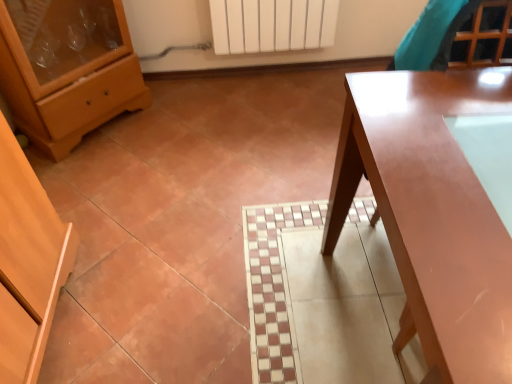
Question: In the image, is glossy wood table at right positioned in front of or behind matte wood chest of drawers at left?

Choices:
 (A) behind
 (B) front

Answer: (B)

Question: In terms of width, does glossy wood table at right look wider or thinner when compared to matte wood chest of drawers at left?

Choices:
 (A) wide
 (B) thin

Answer: (A)

Question: Does point (342, 183) appear closer or farther from the camera than point (103, 11)?

Choices:
 (A) closer
 (B) farther

Answer: (A)

Question: From the image's perspective, is matte wood chest of drawers at left above or below glossy wood table at right?

Choices:
 (A) below
 (B) above

Answer: (B)

Question: Is matte wood chest of drawers at left wider or thinner than glossy wood table at right?

Choices:
 (A) thin
 (B) wide

Answer: (A)

Question: Is point (32, 79) closer or farther from the camera than point (510, 299)?

Choices:
 (A) farther
 (B) closer

Answer: (A)

Question: In terms of height, does matte wood chest of drawers at left look taller or shorter compared to glossy wood table at right?

Choices:
 (A) short
 (B) tall

Answer: (A)